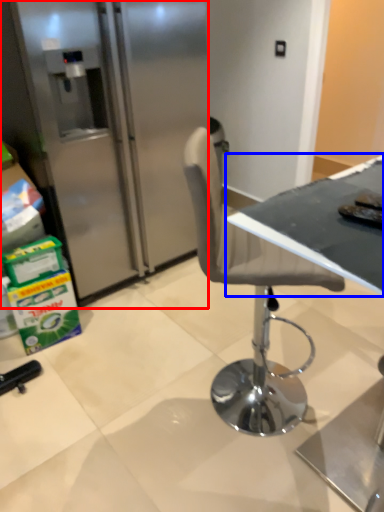
Question: Which object appears closest to the camera in this image, refrigerator (highlighted by a red box) or table (highlighted by a blue box)?

Choices:
 (A) refrigerator
 (B) table

Answer: (B)